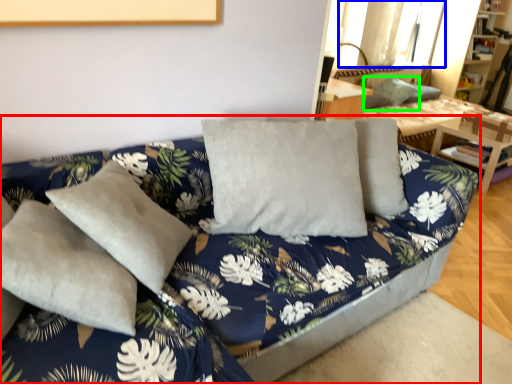
Question: Which object is positioned closest to studio couch (highlighted by a red box)? Select from window (highlighted by a blue box) and pillow (highlighted by a green box).

Choices:
 (A) window
 (B) pillow

Answer: (B)